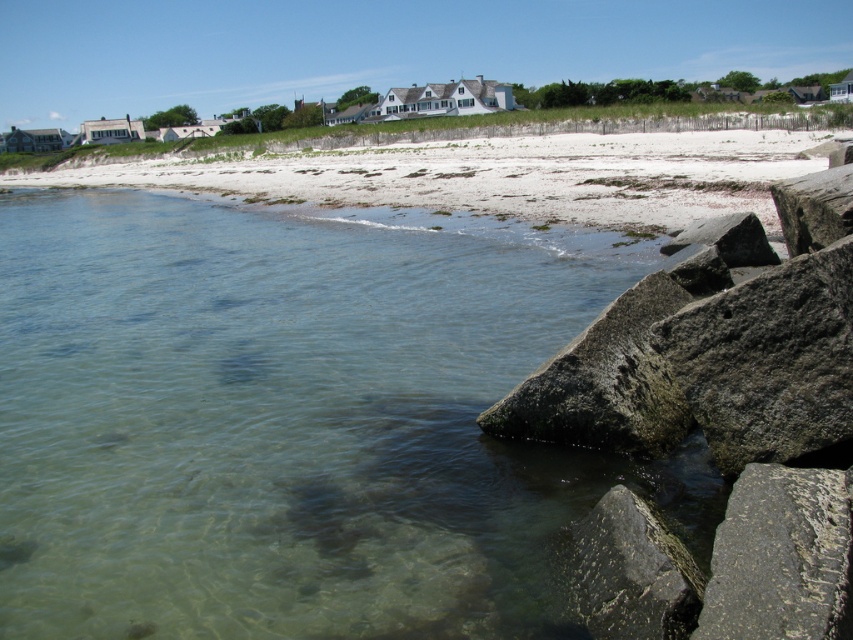
Consider the image. Is clear water at lower left positioned before gray rough rocks at lower right?

That is True.

Can you confirm if clear water at lower left is shorter than gray rough rocks at lower right?

Incorrect, clear water at lower left's height does not fall short of gray rough rocks at lower right's.

Is point (366, 620) positioned in front of point (827, 634)?

No, it is not.

Find the location of `clear water at lower left`. clear water at lower left is located at coordinates point(288,422).

Who is lower down, white sand beach at upper center or gray rough rock at lower right?

gray rough rock at lower right is lower down.

Who is more distant from viewer, (688, 154) or (735, 522)?

The point (688, 154) is behind.

Locate an element on the screen. white sand beach at upper center is located at coordinates (498, 176).

You are a GUI agent. You are given a task and a screenshot of the screen. Output one action in this format:
    pyautogui.click(x=<x>, y=<y>)
    Task: Click on the white sand beach at upper center
    The width and height of the screenshot is (853, 640).
    Given the screenshot: What is the action you would take?
    point(498,176)

Find the location of `gray rough rocks at lower right`. gray rough rocks at lower right is located at coordinates (717, 444).

At what (x,y) coordinates should I click in order to perform the action: click on gray rough rocks at lower right. Please return your answer as a coordinate pair (x, y). Looking at the image, I should click on (717, 444).

You are a GUI agent. You are given a task and a screenshot of the screen. Output one action in this format:
    pyautogui.click(x=<x>, y=<y>)
    Task: Click on the gray rough rocks at lower right
    
    Given the screenshot: What is the action you would take?
    pyautogui.click(x=717, y=444)